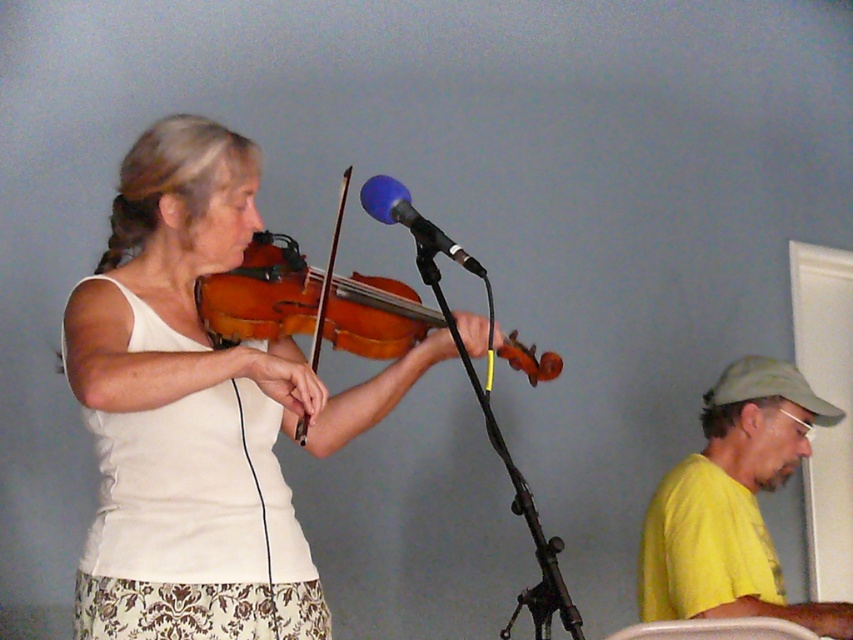
Question: Which of the following is the farthest from the observer?

Choices:
 (A) (300, 259)
 (B) (831, 608)

Answer: (B)

Question: Does yellow matte shirt at lower right have a greater width compared to wooden violin at center?

Choices:
 (A) yes
 (B) no

Answer: (B)

Question: Which of these objects is positioned farthest from the wooden violin at center?

Choices:
 (A) blue foam microphone at center
 (B) yellow matte shirt at lower right

Answer: (B)

Question: Is yellow matte shirt at lower right wider than blue foam microphone at center?

Choices:
 (A) no
 (B) yes

Answer: (B)

Question: Observing the image, what is the correct spatial positioning of wooden violin at center in reference to blue foam microphone at center?

Choices:
 (A) right
 (B) left

Answer: (B)

Question: Among these objects, which one is farthest from the camera?

Choices:
 (A) matte wood violin at center
 (B) yellow matte shirt at lower right
 (C) wooden violin at center

Answer: (B)